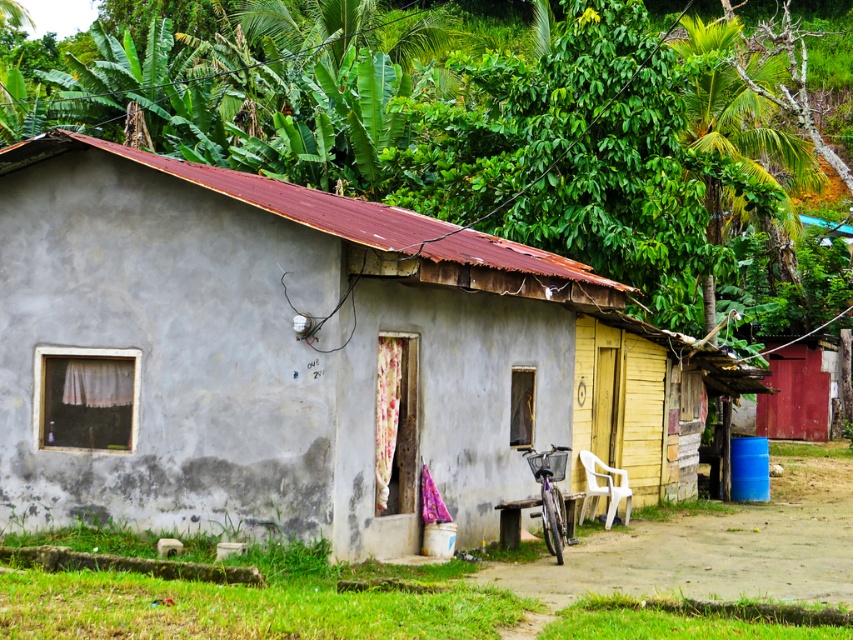
You are standing outside the gray concrete hut at center and want to see the view behind it. Can you see the green leafy vegetation at upper center from your current position?

The gray concrete hut at center is in front of green leafy vegetation at upper center, so you cannot see the green leafy vegetation at upper center from your current position because it is blocked by the hut.

In the scene shown: You are standing in front of the rural house and want to take a photo that includes both the gray concrete hut at center and the green leafy vegetation at upper center. Based on their positions, which object should you position to the left side of your camera frame to include both?

To include both the gray concrete hut at center and the green leafy vegetation at upper center in your photo, you should position the green leafy vegetation at upper center to the left side of your camera frame since the gray concrete hut at center is to the right of it.

You are standing in front of the gray concrete hut at center and looking towards the green leafy vegetation at upper center. Which object is taller?

The green leafy vegetation at upper center is taller than the gray concrete hut at center.